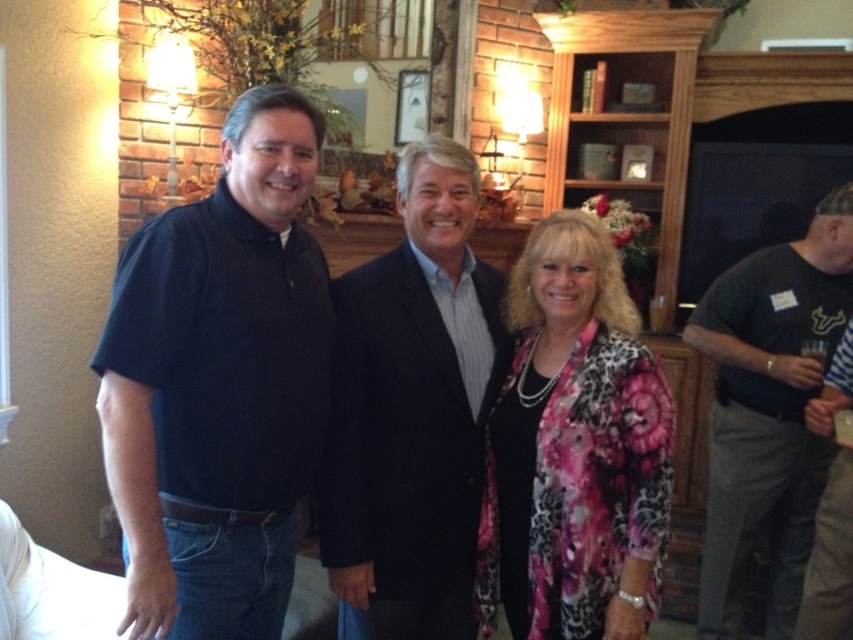
Does dark blue polo shirt at left have a lesser height compared to pink floral jacket at center?

No, dark blue polo shirt at left is not shorter than pink floral jacket at center.

Is point (309, 182) closer to viewer compared to point (619, 552)?

Yes, it is in front of point (619, 552).

This screenshot has width=853, height=640. I want to click on dark blue polo shirt at left, so click(x=219, y=384).

Between point (460, 344) and point (566, 368), which one is positioned behind?

Point (460, 344)

Is point (351, 540) less distant than point (514, 547)?

Yes, point (351, 540) is closer to viewer.

At what (x,y) coordinates should I click in order to perform the action: click on dark blue suit at center. Please return your answer as a coordinate pair (x, y). Looking at the image, I should click on (412, 412).

Which of these two, dark blue suit at center or striped shirt at right, stands shorter?

Standing shorter between the two is striped shirt at right.

This screenshot has width=853, height=640. I want to click on dark blue suit at center, so click(412, 412).

Where is `dark blue suit at center`? This screenshot has height=640, width=853. dark blue suit at center is located at coordinates point(412,412).